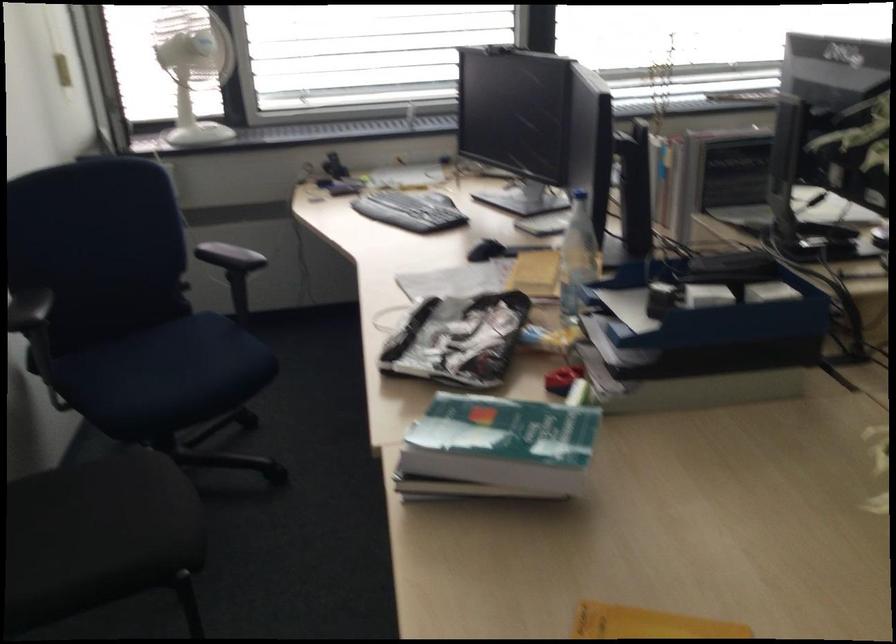
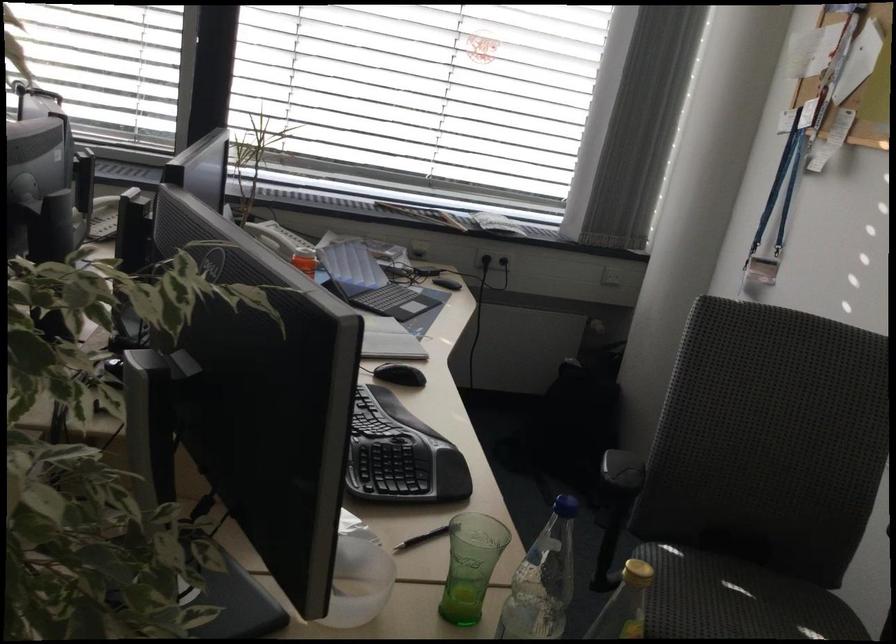
Question: What movement of the cameraman would produce the second image?

Choices:
 (A) Left
 (B) Right
 (C) Forward
 (D) Backward

Answer: (B)